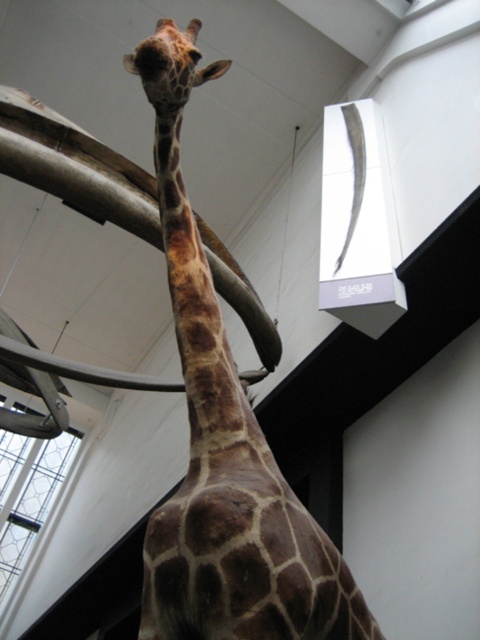
Question: Among these points, which one is nearest to the camera?

Choices:
 (A) (135, 52)
 (B) (159, 224)
 (C) (181, 310)

Answer: (A)

Question: Estimate the real-world distances between objects in this image. Which object is closer to the brown textured neck at center?

Choices:
 (A) matte gray beam at upper center
 (B) brown spotted giraffe at center
 (C) brown spotted giraffe head at upper center

Answer: (B)

Question: Considering the relative positions of brown spotted giraffe at center and brown spotted giraffe head at upper center in the image provided, where is brown spotted giraffe at center located with respect to brown spotted giraffe head at upper center?

Choices:
 (A) below
 (B) above

Answer: (A)

Question: Which object appears closest to the camera in this image?

Choices:
 (A) brown textured neck at center
 (B) brown spotted giraffe at center
 (C) matte gray beam at upper center
 (D) brown spotted giraffe head at upper center

Answer: (B)

Question: Does brown spotted giraffe at center lie behind matte gray beam at upper center?

Choices:
 (A) yes
 (B) no

Answer: (B)

Question: Where is brown spotted giraffe at center located in relation to matte gray beam at upper center in the image?

Choices:
 (A) right
 (B) left

Answer: (A)